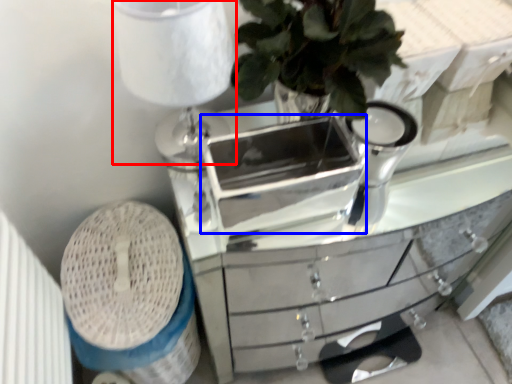
Question: Which point is further to the camera, table lamp (highlighted by a red box) or appliance (highlighted by a blue box)?

Choices:
 (A) table lamp
 (B) appliance

Answer: (B)